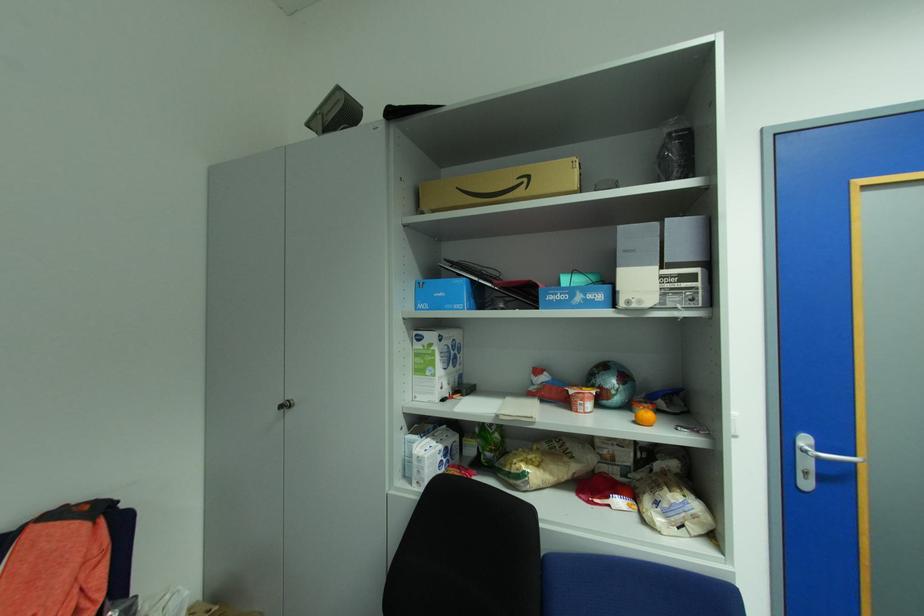
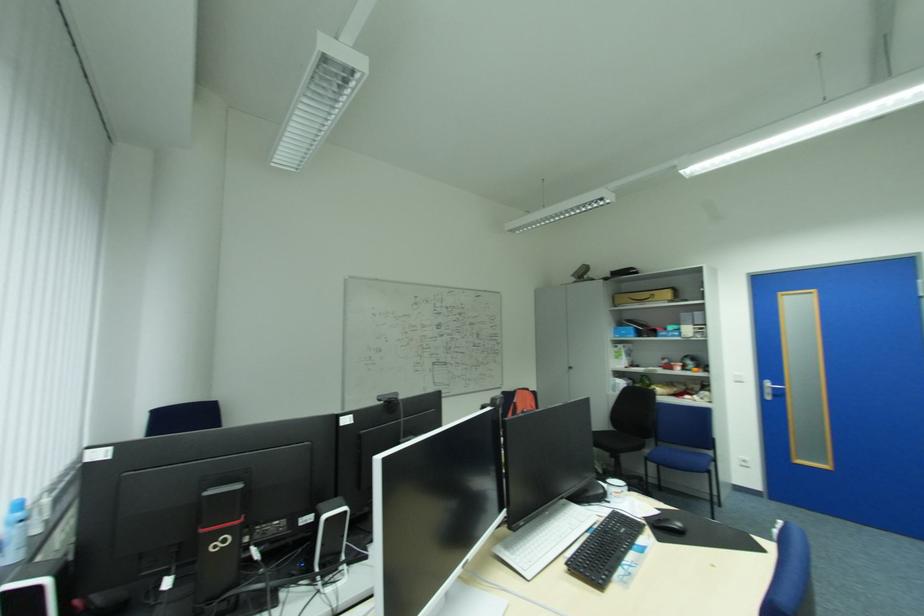
Question: The images are taken continuously from a first-person perspective. In which direction are you moving?

Choices:
 (A) Left
 (B) Right
 (C) Forward
 (D) Backward

Answer: (D)